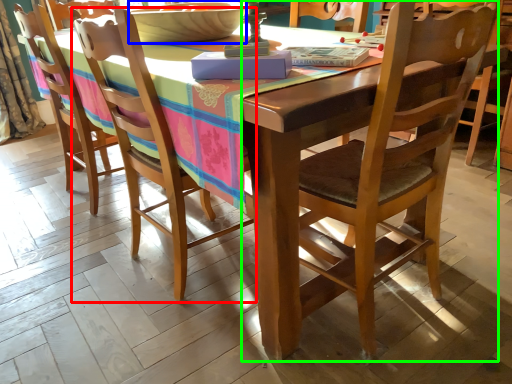
Question: Considering the real-world distances, which object is farthest from chair (highlighted by a red box)? bowl (highlighted by a blue box) or chair (highlighted by a green box)?

Choices:
 (A) bowl
 (B) chair

Answer: (B)